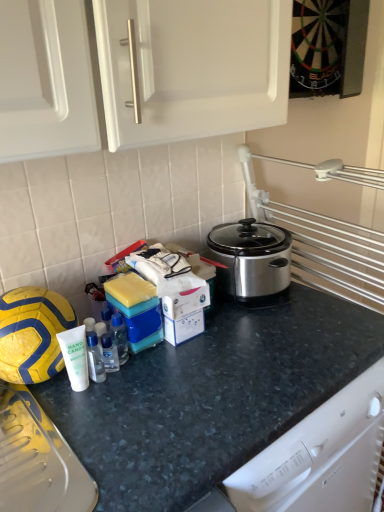
Locate an element on the screen. The image size is (384, 512). vacant area that is situated to the right of clear plastic bottle at center, the 1th bottle from the front is located at coordinates (135, 398).